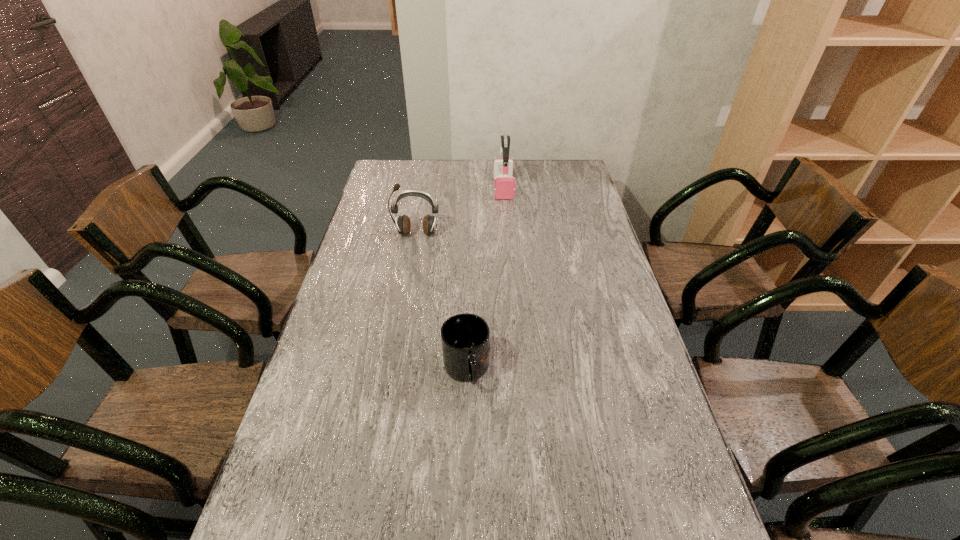
I want to click on the right earphone, so click(504, 186).

What are the coordinates of `the farther earphone` in the screenshot? It's located at (504, 186).

At what (x,y) coordinates should I click in order to perform the action: click on the leftmost object. Please return your answer as a coordinate pair (x, y). Looking at the image, I should click on (403, 223).

This screenshot has height=540, width=960. Identify the location of the second farthest object. (403, 223).

You are a GUI agent. You are given a task and a screenshot of the screen. Output one action in this format:
    pyautogui.click(x=<x>, y=<y>)
    Task: Click on the shortest object
    The height and width of the screenshot is (540, 960).
    Given the screenshot: What is the action you would take?
    pyautogui.click(x=465, y=338)

This screenshot has width=960, height=540. I want to click on the second object from left to right, so click(x=465, y=338).

The width and height of the screenshot is (960, 540). What are the coordinates of `vacant area situated on the outer surface of the rightmost object` in the screenshot? It's located at (508, 247).

Locate an element on the screen. The width and height of the screenshot is (960, 540). vacant point located on the ear pads of the leftmost object is located at coordinates (405, 294).

Locate an element on the screen. The width and height of the screenshot is (960, 540). free point located 0.260m with the handle on the side of the mug is located at coordinates (463, 504).

At what (x,y) coordinates should I click in order to perform the action: click on object at the far edge. Please return your answer as a coordinate pair (x, y). Image resolution: width=960 pixels, height=540 pixels. Looking at the image, I should click on (504, 186).